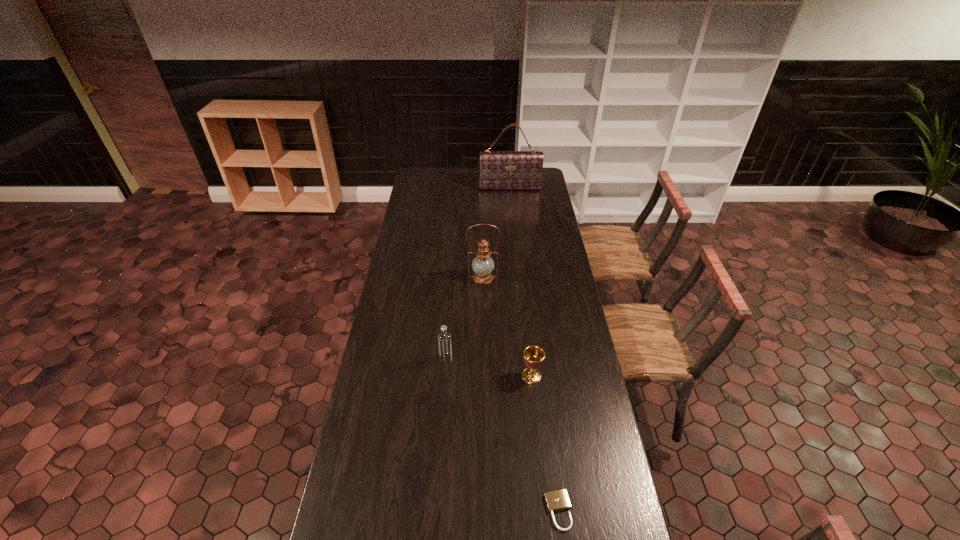
This screenshot has height=540, width=960. I want to click on the tallest object, so click(x=498, y=170).

At what (x,y) coordinates should I click in order to perform the action: click on handbag. Please return your answer as a coordinate pair (x, y). The image size is (960, 540). Looking at the image, I should click on (498, 170).

Find the location of `oil lamp`. oil lamp is located at coordinates (482, 264).

You are a GUI agent. You are given a task and a screenshot of the screen. Output one action in this format:
    pyautogui.click(x=<x>, y=<y>)
    Task: Click on the second farthest object
    This screenshot has width=960, height=540.
    Given the screenshot: What is the action you would take?
    pyautogui.click(x=482, y=264)

At what (x,y) coordinates should I click in order to perform the action: click on the third tallest object. Please return your answer as a coordinate pair (x, y). The height and width of the screenshot is (540, 960). Looking at the image, I should click on (444, 339).

The height and width of the screenshot is (540, 960). What are the coordinates of `the third nearest object` in the screenshot? It's located at (444, 339).

The image size is (960, 540). I want to click on chalice, so click(533, 355).

This screenshot has height=540, width=960. What are the coordinates of `the second shortest object` in the screenshot? It's located at (533, 355).

At what (x,y) coordinates should I click in order to perform the action: click on padlock. Please return your answer as a coordinate pair (x, y). Looking at the image, I should click on pos(557,500).

The image size is (960, 540). I want to click on the shortest object, so click(557, 500).